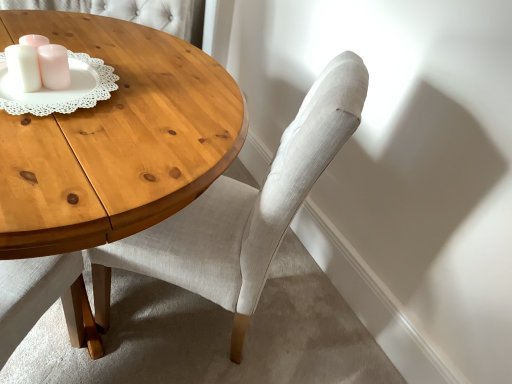
The height and width of the screenshot is (384, 512). I want to click on free space to the right of white matte candle holder at upper left, so click(134, 93).